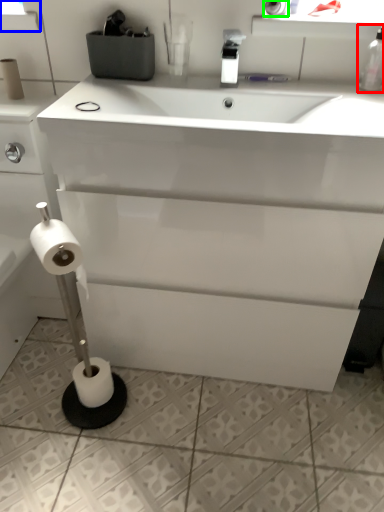
Question: Which object is positioned farthest from bottle (highlighted by a red box)? Select from window screen (highlighted by a blue box) and toilet paper (highlighted by a green box).

Choices:
 (A) window screen
 (B) toilet paper

Answer: (A)